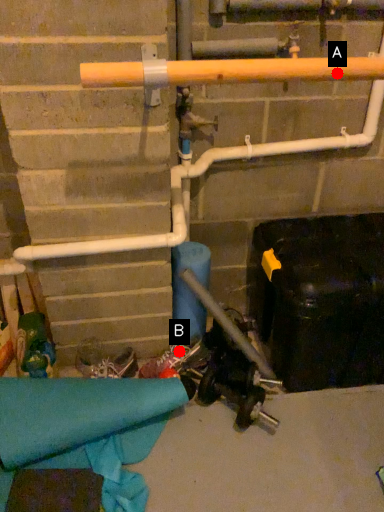
Question: Two points are circled on the image, labeled by A and B beside each circle. Which point is closer to the camera?

Choices:
 (A) A is closer
 (B) B is closer

Answer: (A)